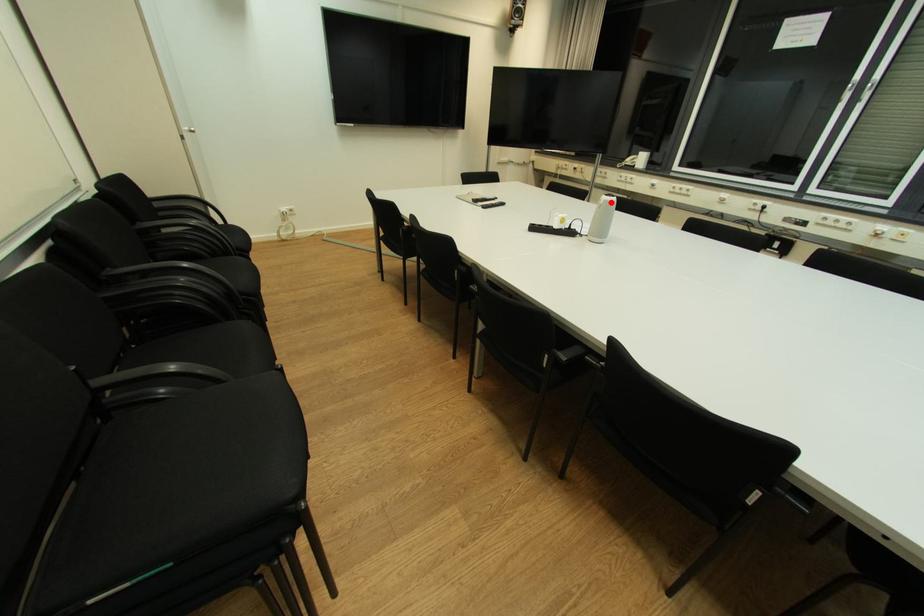
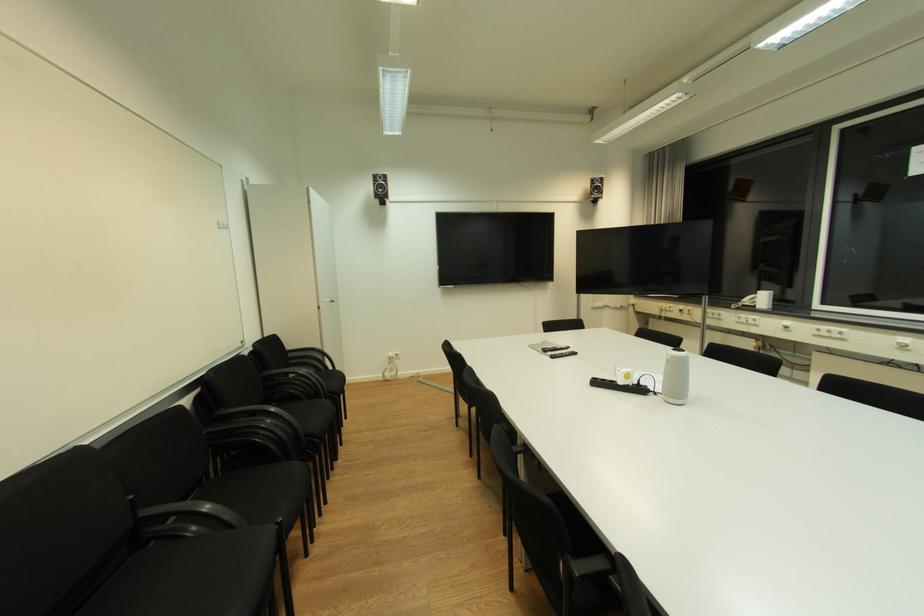
Locate, in the second image, the point that corresponds to the highlighted location in the first image.

(678, 358)